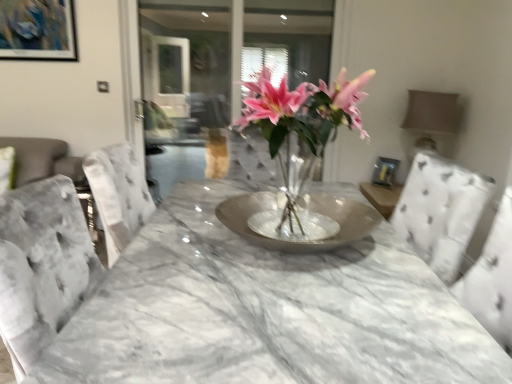
Question: Considering the relative sizes of pink glass vase at center and transparent glass door at upper center in the image provided, is pink glass vase at center thinner than transparent glass door at upper center?

Choices:
 (A) no
 (B) yes

Answer: (A)

Question: Does pink glass vase at center have a greater width compared to transparent glass door at upper center?

Choices:
 (A) no
 (B) yes

Answer: (B)

Question: Is transparent glass door at upper center at the back of pink glass vase at center?

Choices:
 (A) yes
 (B) no

Answer: (B)

Question: Is pink glass vase at center positioned beyond the bounds of transparent glass door at upper center?

Choices:
 (A) no
 (B) yes

Answer: (B)

Question: From a real-world perspective, is pink glass vase at center positioned over transparent glass door at upper center based on gravity?

Choices:
 (A) no
 (B) yes

Answer: (A)

Question: Considering the positions of point (321, 140) and point (194, 51), is point (321, 140) closer or farther from the camera than point (194, 51)?

Choices:
 (A) closer
 (B) farther

Answer: (A)

Question: From the image's perspective, is pink glass vase at center located above or below transparent glass door at upper center?

Choices:
 (A) above
 (B) below

Answer: (B)

Question: Is pink glass vase at center situated inside transparent glass door at upper center or outside?

Choices:
 (A) inside
 (B) outside

Answer: (B)

Question: From their relative heights in the image, would you say pink glass vase at center is taller or shorter than transparent glass door at upper center?

Choices:
 (A) tall
 (B) short

Answer: (B)

Question: Choose the correct answer: Is metallic silver picture frame at upper left inside transparent glass door at upper center or outside it?

Choices:
 (A) inside
 (B) outside

Answer: (B)

Question: From a real-world perspective, is metallic silver picture frame at upper left above or below transparent glass door at upper center?

Choices:
 (A) below
 (B) above

Answer: (B)

Question: Is metallic silver picture frame at upper left in front of or behind transparent glass door at upper center in the image?

Choices:
 (A) front
 (B) behind

Answer: (A)

Question: Is point (59, 59) positioned closer to the camera than point (325, 44)?

Choices:
 (A) farther
 (B) closer

Answer: (B)

Question: Is transparent glass door at upper center taller or shorter than pink glass vase at center?

Choices:
 (A) short
 (B) tall

Answer: (B)

Question: In the image, is transparent glass door at upper center on the left side or the right side of pink glass vase at center?

Choices:
 (A) left
 (B) right

Answer: (A)